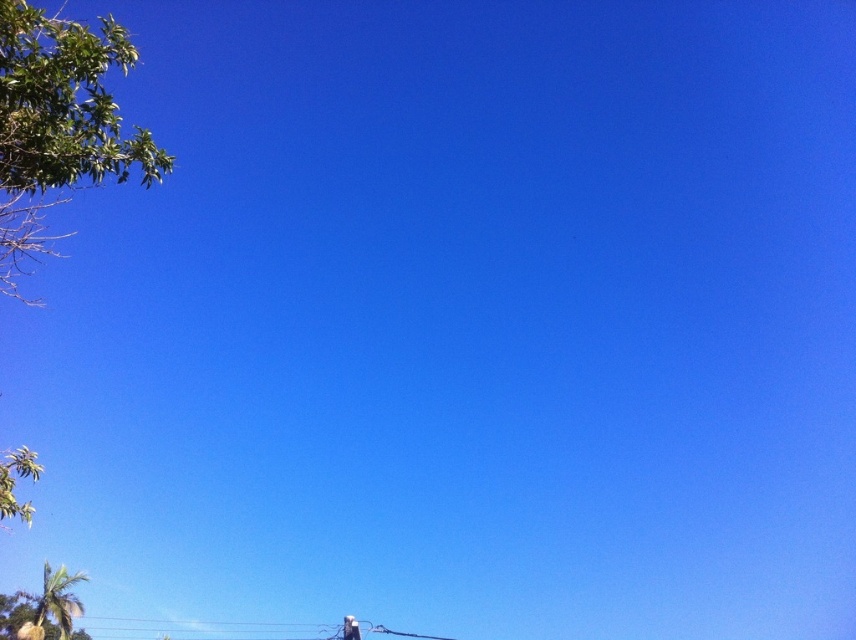
Does green leafy tree at upper left come behind green leafy palm tree at upper left?

No, it is not.

Which is behind, point (99, 58) or point (46, 580)?

The point (46, 580) is behind.

The height and width of the screenshot is (640, 856). In order to click on green leafy tree at upper left in this screenshot , I will do `click(58, 122)`.